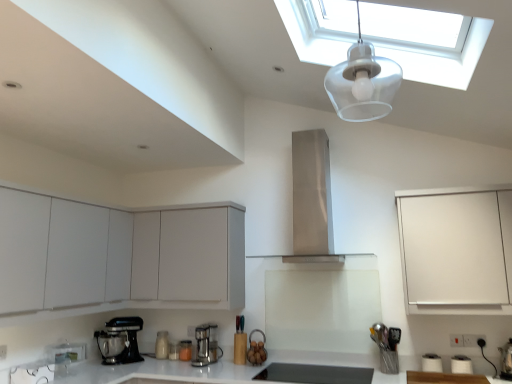
Question: Would you say matte white blender at center, the third kitchen appliance from the right, is part of white matte cabinet at center, the second cabinetry from the left,'s contents?

Choices:
 (A) yes
 (B) no

Answer: (B)

Question: Is white matte cabinet at center, the second cabinetry from the left, bigger than matte white blender at center, acting as the 2th kitchen appliance starting from the left?

Choices:
 (A) no
 (B) yes

Answer: (B)

Question: From the image's perspective, would you say white matte cabinet at center, the second cabinetry from the left, is shown under matte white blender at center, acting as the 2th kitchen appliance starting from the left?

Choices:
 (A) no
 (B) yes

Answer: (A)

Question: Are white matte cabinet at center, positioned as the 2th cabinetry in right-to-left order, and matte white blender at center, the third kitchen appliance from the right, far apart?

Choices:
 (A) no
 (B) yes

Answer: (A)

Question: Could you tell me if white matte cabinet at center, the second cabinetry from the left, is turned towards matte white blender at center, the third kitchen appliance from the right?

Choices:
 (A) yes
 (B) no

Answer: (B)

Question: From a real-world perspective, is white matte cabinet at center, positioned as the 2th cabinetry in right-to-left order, below matte white blender at center, acting as the 2th kitchen appliance starting from the left?

Choices:
 (A) no
 (B) yes

Answer: (A)

Question: From the image's perspective, is white matte cabinet at lower left, which is the third cabinetry from right to left, over white matte cabinet at right, arranged as the 1th cabinetry when viewed from the right?

Choices:
 (A) no
 (B) yes

Answer: (B)

Question: Is there a large distance between white matte cabinet at lower left, which is counted as the 1th cabinetry, starting from the left, and white matte cabinet at right, arranged as the 1th cabinetry when viewed from the right?

Choices:
 (A) yes
 (B) no

Answer: (A)

Question: Considering the relative sizes of white matte cabinet at lower left, which is the third cabinetry from right to left, and white matte cabinet at right, arranged as the 1th cabinetry when viewed from the right, in the image provided, is white matte cabinet at lower left, which is the third cabinetry from right to left, bigger than white matte cabinet at right, arranged as the 1th cabinetry when viewed from the right,?

Choices:
 (A) yes
 (B) no

Answer: (A)

Question: Can you confirm if white matte cabinet at lower left, which is the third cabinetry from right to left, is smaller than white matte cabinet at right, which is counted as the third cabinetry, starting from the left?

Choices:
 (A) yes
 (B) no

Answer: (B)

Question: Is white matte cabinet at lower left, which is counted as the 1th cabinetry, starting from the left, turned away from white matte cabinet at right, arranged as the 1th cabinetry when viewed from the right?

Choices:
 (A) yes
 (B) no

Answer: (B)

Question: Considering the relative sizes of white matte cabinet at lower left, which is counted as the 1th cabinetry, starting from the left, and white matte cabinet at right, arranged as the 1th cabinetry when viewed from the right, in the image provided, is white matte cabinet at lower left, which is counted as the 1th cabinetry, starting from the left, thinner than white matte cabinet at right, arranged as the 1th cabinetry when viewed from the right,?

Choices:
 (A) no
 (B) yes

Answer: (A)

Question: Considering the relative positions of white matte cabinet at right, which is counted as the third cabinetry, starting from the left, and transparent plastic light fixture at upper center in the image provided, is white matte cabinet at right, which is counted as the third cabinetry, starting from the left, to the right of transparent plastic light fixture at upper center from the viewer's perspective?

Choices:
 (A) no
 (B) yes

Answer: (B)